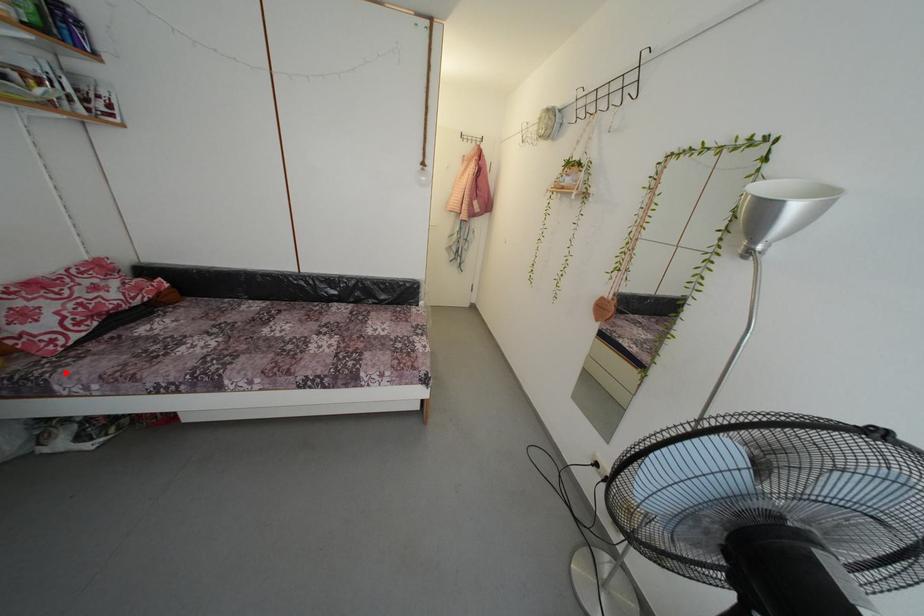
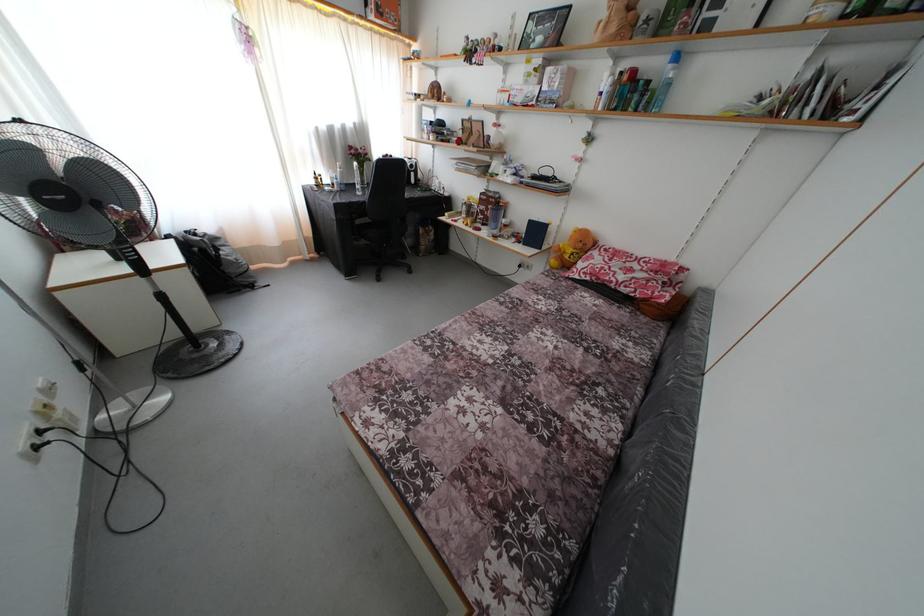
Locate, in the second image, the point that corresponds to the highlighted location in the first image.

(552, 282)